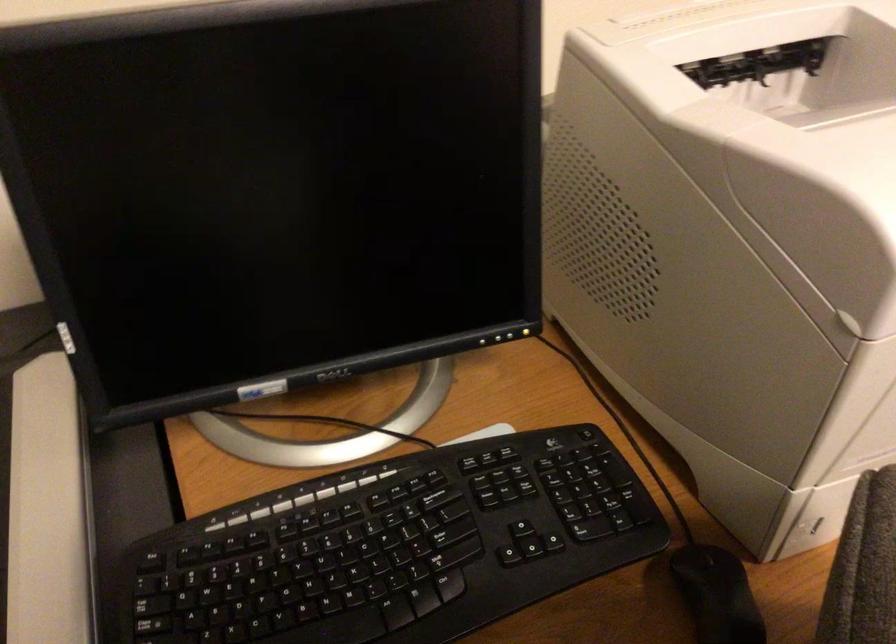
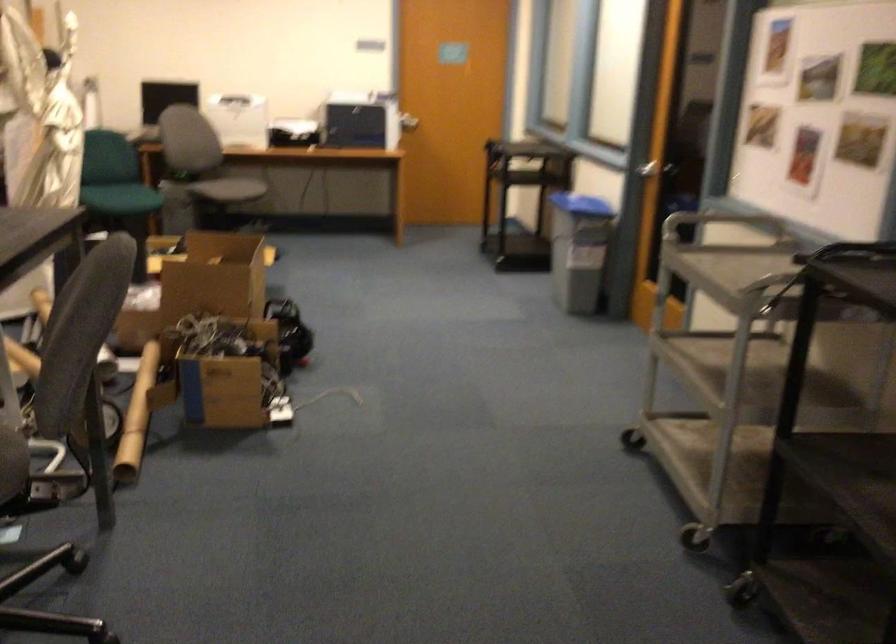
Question: I am providing you with two images of the same scene from different viewpoints. Please identify which objects are invisible in image2.

Choices:
 (A) monitor control button
 (B) green chair sitting surface
 (C) white pot lid
 (D) cardboard box

Answer: (A)